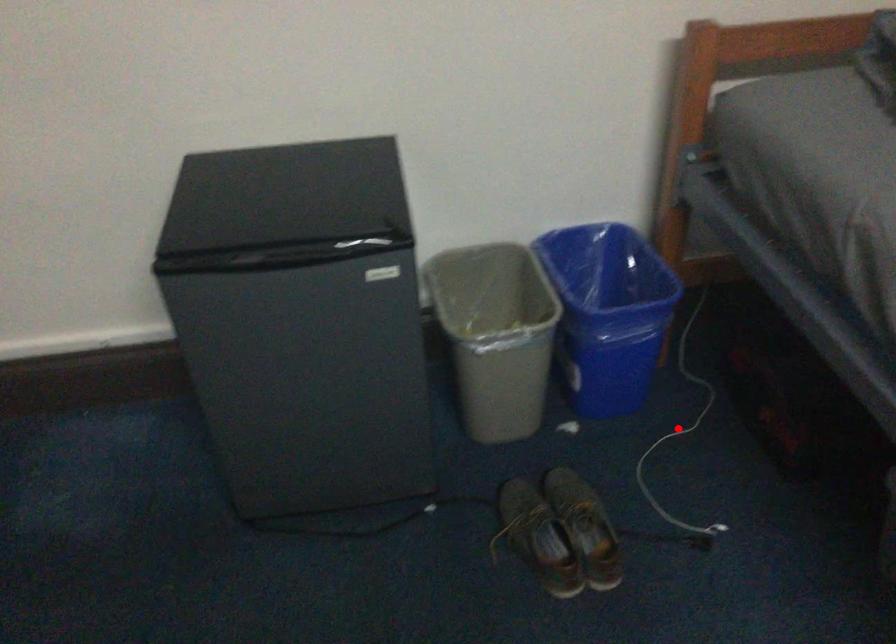
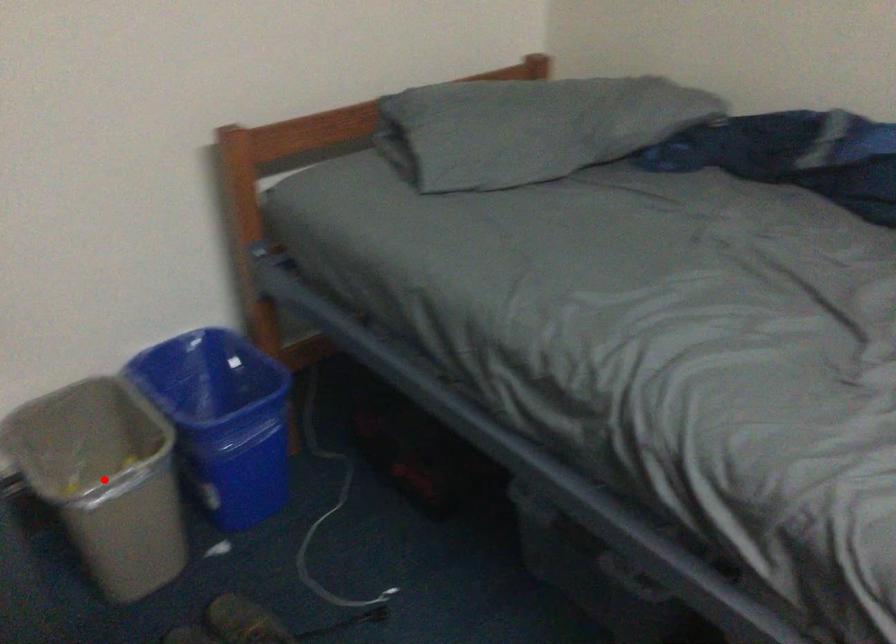
I am providing you with two images of the same scene from different viewpoints. A red point is marked on the first image and another point is marked on the second image. Are the points marked in image1 and image2 representing the same 3D position?

No